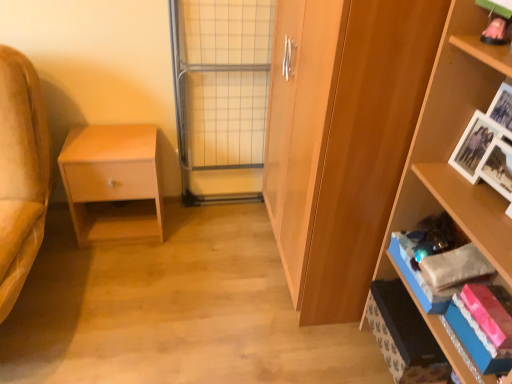
Locate an element on the screen. vacant space that is in between matte wood nightstand at left and metal grid screen door at center is located at coordinates (202, 223).